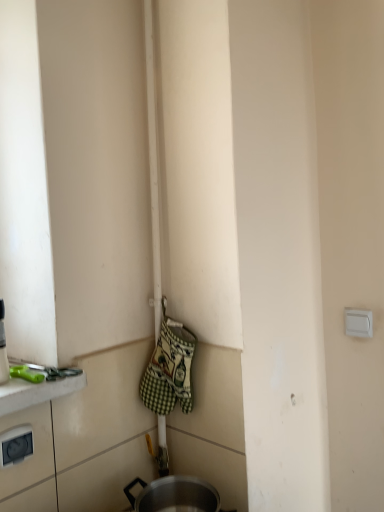
Question: Is white plastic electric outlet at lower left, positioned as the 1th electric outlet in front-to-back order, behind green checkered fabric oven mitts at center?

Choices:
 (A) yes
 (B) no

Answer: (B)

Question: Considering the relative sizes of white plastic electric outlet at lower left, positioned as the 1th electric outlet in front-to-back order, and green checkered fabric oven mitts at center in the image provided, is white plastic electric outlet at lower left, positioned as the 1th electric outlet in front-to-back order, wider than green checkered fabric oven mitts at center?

Choices:
 (A) no
 (B) yes

Answer: (A)

Question: Are white plastic electric outlet at lower left, positioned as the 1th electric outlet in front-to-back order, and green checkered fabric oven mitts at center far apart?

Choices:
 (A) no
 (B) yes

Answer: (A)

Question: Is white plastic electric outlet at lower left, which is the first electric outlet in bottom-to-top order, in front of green checkered fabric oven mitts at center?

Choices:
 (A) no
 (B) yes

Answer: (B)

Question: From a real-world perspective, is white plastic electric outlet at lower left, the first electric outlet viewed from the left, positioned over green checkered fabric oven mitts at center based on gravity?

Choices:
 (A) no
 (B) yes

Answer: (A)

Question: From the image's perspective, is green checkered fabric oven mitts at center above or below white plastic electric outlet at lower left, which is the first electric outlet in bottom-to-top order?

Choices:
 (A) above
 (B) below

Answer: (A)

Question: Considering the positions of green checkered fabric oven mitts at center and white plastic electric outlet at lower left, which is the second electric outlet from back to front, in the image, is green checkered fabric oven mitts at center taller or shorter than white plastic electric outlet at lower left, which is the second electric outlet from back to front,?

Choices:
 (A) short
 (B) tall

Answer: (B)

Question: In terms of width, does green checkered fabric oven mitts at center look wider or thinner when compared to white plastic electric outlet at lower left, which is the second electric outlet from back to front?

Choices:
 (A) thin
 (B) wide

Answer: (B)

Question: Choose the correct answer: Is green checkered fabric oven mitts at center inside white plastic electric outlet at lower left, positioned as the second electric outlet in right-to-left order, or outside it?

Choices:
 (A) inside
 (B) outside

Answer: (B)

Question: In terms of height, does white plastic electric outlet at upper right, the 1th electric outlet positioned from the top, look taller or shorter compared to green plastic scissors at lower left?

Choices:
 (A) tall
 (B) short

Answer: (A)

Question: Considering the positions of point (357, 311) and point (11, 366), is point (357, 311) closer or farther from the camera than point (11, 366)?

Choices:
 (A) farther
 (B) closer

Answer: (A)

Question: From a real-world perspective, is white plastic electric outlet at upper right, placed as the 1th electric outlet when sorted from right to left, physically located above or below green plastic scissors at lower left?

Choices:
 (A) above
 (B) below

Answer: (A)

Question: Considering their positions, is white plastic electric outlet at upper right, the 1th electric outlet positioned from the top, located in front of or behind green plastic scissors at lower left?

Choices:
 (A) front
 (B) behind

Answer: (B)

Question: Considering the positions of white plastic electric outlet at lower left, which is the second electric outlet from back to front, and white plastic electric outlet at upper right, the 2th electric outlet viewed from the left, in the image, is white plastic electric outlet at lower left, which is the second electric outlet from back to front, wider or thinner than white plastic electric outlet at upper right, the 2th electric outlet viewed from the left,?

Choices:
 (A) wide
 (B) thin

Answer: (A)

Question: Is point (23, 439) positioned closer to the camera than point (370, 330)?

Choices:
 (A) closer
 (B) farther

Answer: (A)